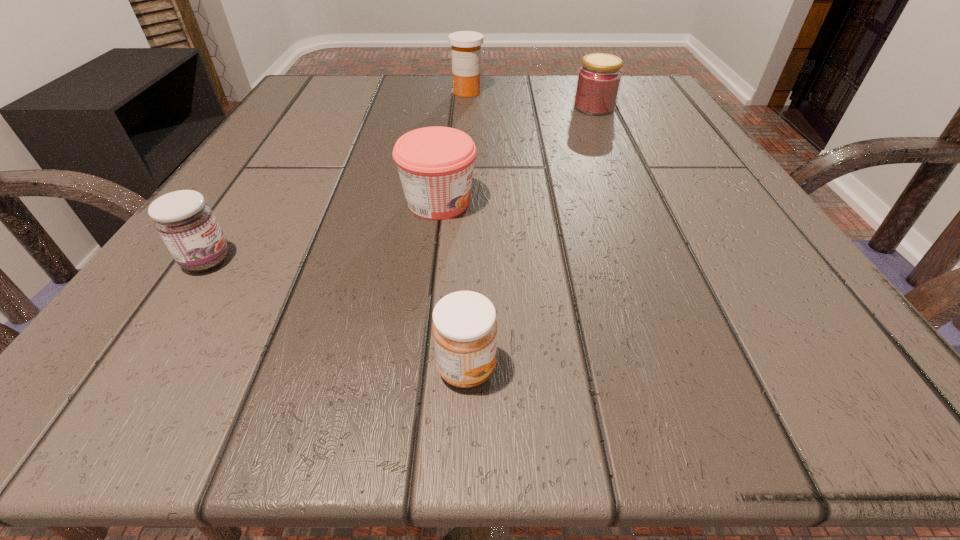
Locate an element on the screen. This screenshot has height=540, width=960. vacant space at the near edge of the desktop is located at coordinates (426, 335).

In the image, there is a desktop. What are the coordinates of `vacant space at the left edge` in the screenshot? It's located at (319, 179).

Image resolution: width=960 pixels, height=540 pixels. What are the coordinates of `vacant area at the far left corner of the desktop` in the screenshot? It's located at (336, 80).

The height and width of the screenshot is (540, 960). I want to click on free region at the near left corner of the desktop, so click(x=110, y=364).

Locate an element on the screen. Image resolution: width=960 pixels, height=540 pixels. free location at the far right corner of the desktop is located at coordinates (644, 116).

Locate an element on the screen. The width and height of the screenshot is (960, 540). vacant space in between the rightmost object and the second farthest jam is located at coordinates (516, 155).

Locate an element on the screen. The image size is (960, 540). empty space that is in between the nearest jam and the third nearest jam is located at coordinates coord(452,285).

Where is `vacant area that lies between the nearest jam and the fourth farthest object`? The image size is (960, 540). vacant area that lies between the nearest jam and the fourth farthest object is located at coordinates (337, 314).

You are a GUI agent. You are given a task and a screenshot of the screen. Output one action in this format:
    pyautogui.click(x=<x>, y=<y>)
    Task: Click on the blank region between the nearest jam and the tallest object
    This screenshot has height=540, width=960.
    Given the screenshot: What is the action you would take?
    pyautogui.click(x=467, y=231)

Locate an element on the screen. Image resolution: width=960 pixels, height=540 pixels. unoccupied area between the nearest jam and the rightmost object is located at coordinates (530, 238).